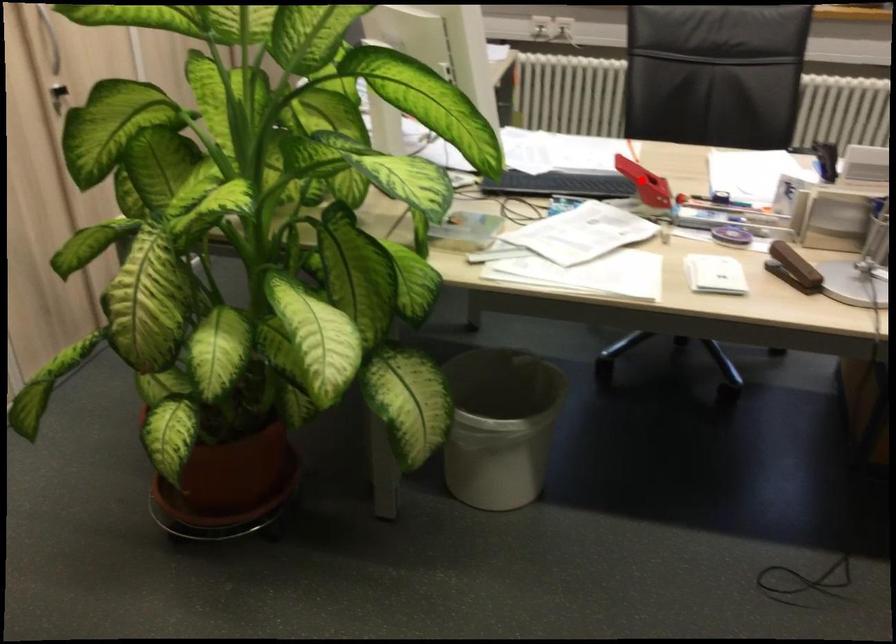
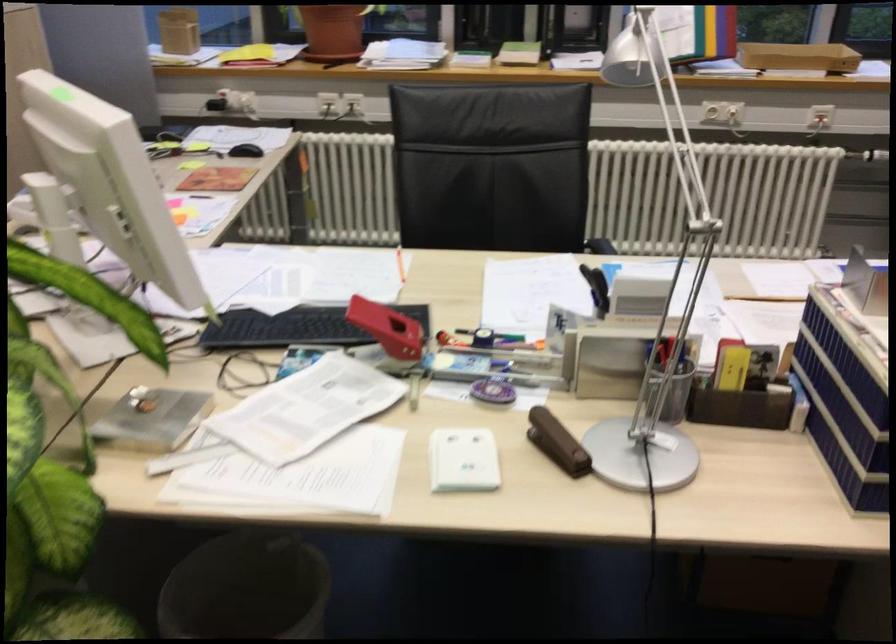
Find the pixel in the second image that matches the highlighted location in the first image.

(386, 328)